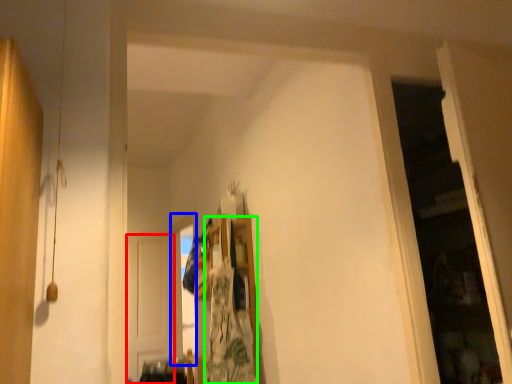
Question: Which is nearer to the door (highlighted by a red box)? window (highlighted by a blue box) or laundry (highlighted by a green box).

Choices:
 (A) window
 (B) laundry

Answer: (A)